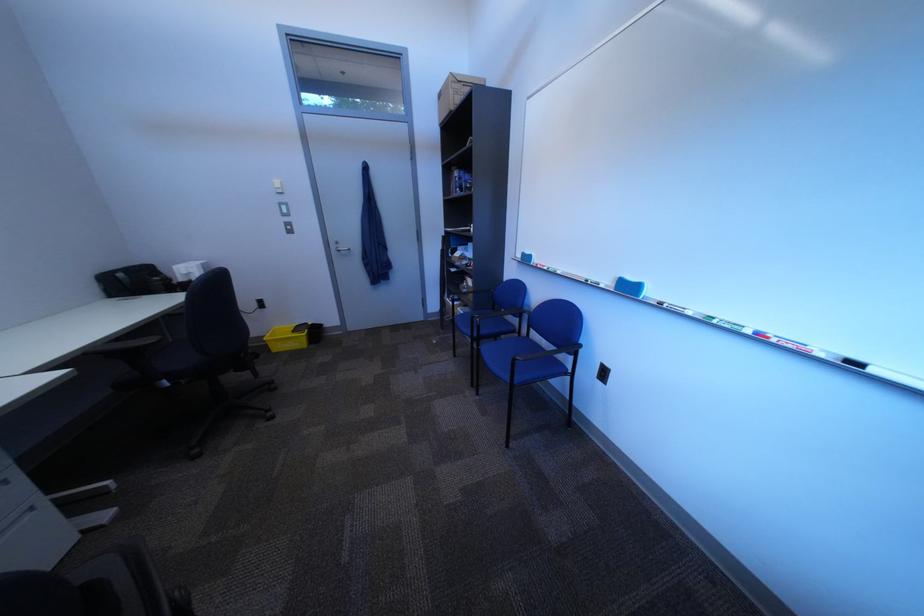
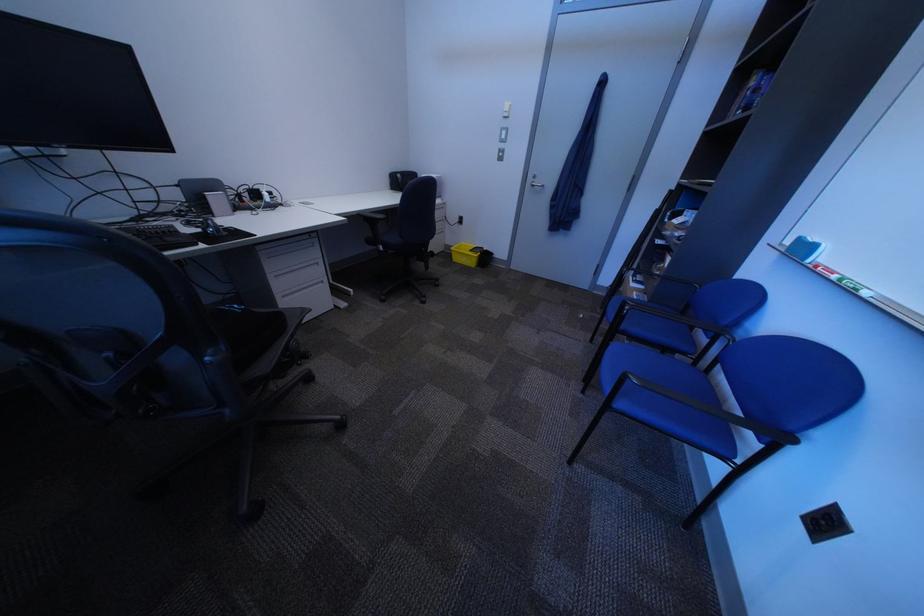
Locate, in the second image, the point that corresponds to the point at 561,270 in the first image.

(849, 278)